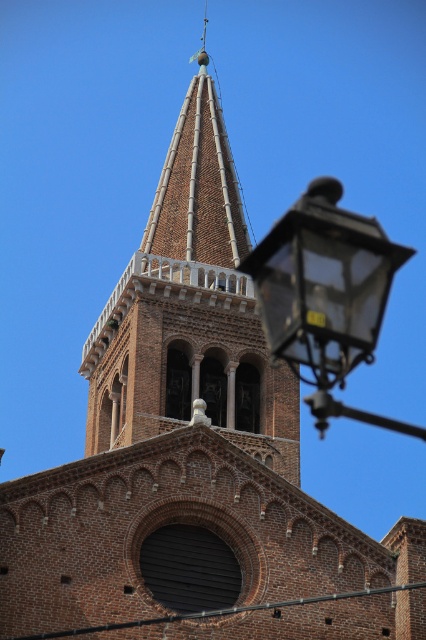
You are an architect examining the historic brick building. You notice the brown brick tower at upper center and the clear glass lantern at upper right. Which of these two objects is positioned higher in the image?

The brown brick tower at upper center is located above the clear glass lantern at upper right, so it is positioned higher in the image.

You are an architect analyzing the spatial dimensions of the historic building. Given that the brown brick tower at upper center and the clear glass lantern at upper right are both visible in the image, which structure takes up more visual space in the composition?

The clear glass lantern at upper right takes up more visual space than the brown brick tower at upper center, as stated in the description that the brown brick tower occupies less space than the clear glass lantern.